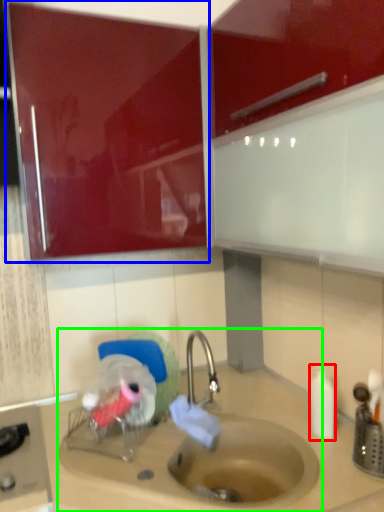
Question: Based on their relative distances, which object is farther from bottle (highlighted by a red box)? Choose from cabinetry (highlighted by a blue box) and sink (highlighted by a green box).

Choices:
 (A) cabinetry
 (B) sink

Answer: (A)